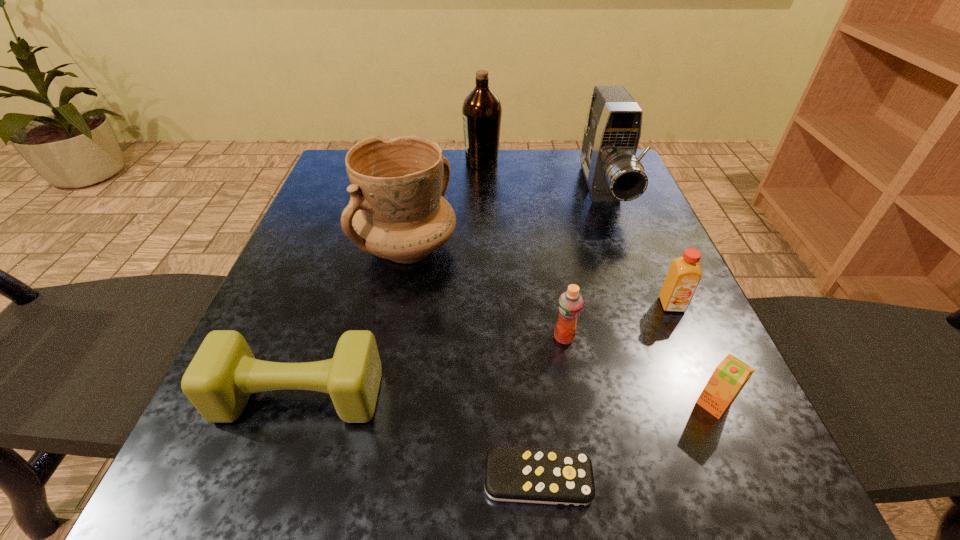
Locate an element on the screen. The width and height of the screenshot is (960, 540). olive oil that is at the far edge is located at coordinates (482, 110).

The height and width of the screenshot is (540, 960). I want to click on camcorder that is at the far edge, so click(613, 173).

This screenshot has height=540, width=960. In order to click on object situated at the near edge in this screenshot , I will do `click(563, 477)`.

Locate an element on the screen. The width and height of the screenshot is (960, 540). pottery positioned at the left edge is located at coordinates (397, 211).

Identify the location of dumbbell positioned at the left edge. (223, 374).

At what (x,y) coordinates should I click in order to perform the action: click on camcorder located at the right edge. Please return your answer as a coordinate pair (x, y). The width and height of the screenshot is (960, 540). Looking at the image, I should click on (613, 173).

This screenshot has height=540, width=960. In order to click on object that is at the far right corner in this screenshot , I will do `click(613, 173)`.

The height and width of the screenshot is (540, 960). In the image, there is a desktop. In order to click on vacant area at the far edge in this screenshot , I will do `click(508, 187)`.

Find the location of a particular element. The image size is (960, 540). vacant space at the left edge of the desktop is located at coordinates click(301, 268).

Where is `vacant space at the right edge`? Image resolution: width=960 pixels, height=540 pixels. vacant space at the right edge is located at coordinates (701, 323).